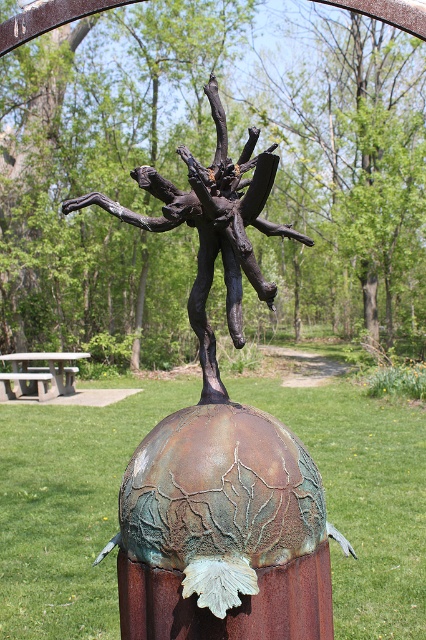
What are the coordinates of the rusty metal sculpture at center?

The coordinates of the rusty metal sculpture at center are at point (219,449).

You are a park visitor who wants to take a photo of the rusty metal sculpture at center from the gray concrete picnic table at lower left. Considering the distance between them, do you think you can comfortably take a clear photo without needing a zoom lens?

The distance between the rusty metal sculpture at center and the gray concrete picnic table at lower left is 69.40 feet. A standard camera lens may struggle to capture a clear image of the sculpture from that distance without zoom, so it is recommended to use a zoom lens for clarity.